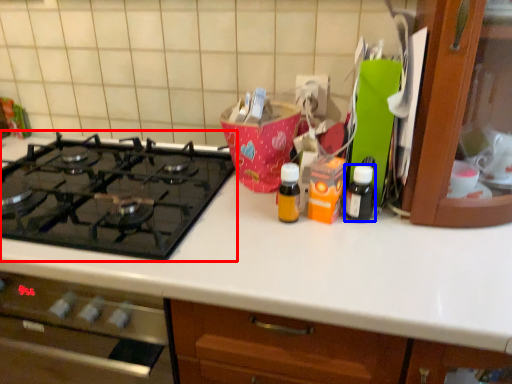
Question: Which point is further to the camera, gas stove (highlighted by a red box) or bottle (highlighted by a blue box)?

Choices:
 (A) gas stove
 (B) bottle

Answer: (B)